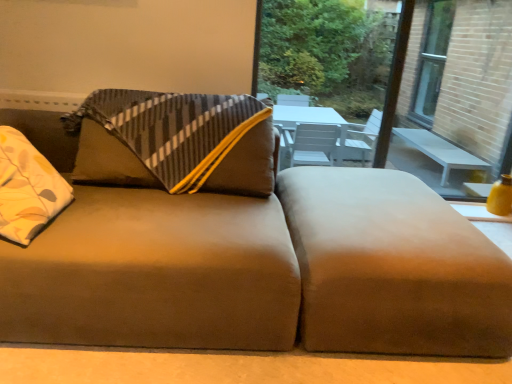
Locate an element on the screen. This screenshot has height=384, width=512. blank space situated above suede-like brown footrest at lower right (from a real-world perspective) is located at coordinates (372, 192).